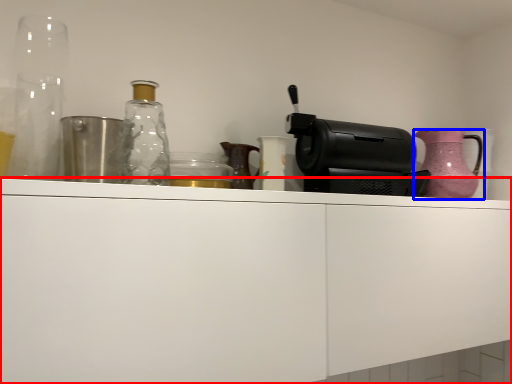
Question: Which object is closer to the camera taking this photo, cabinetry (highlighted by a red box) or jug (highlighted by a blue box)?

Choices:
 (A) cabinetry
 (B) jug

Answer: (A)